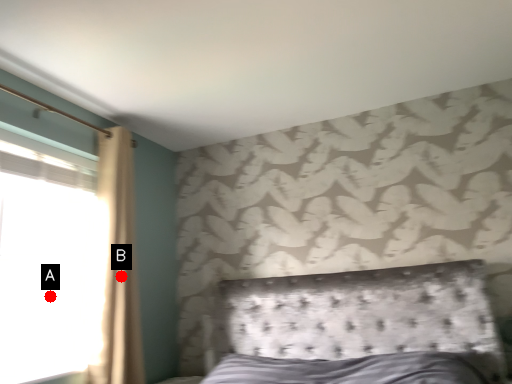
Question: Two points are circled on the image, labeled by A and B beside each circle. Which of the following is the farthest from the observer?

Choices:
 (A) A is further
 (B) B is further

Answer: (A)